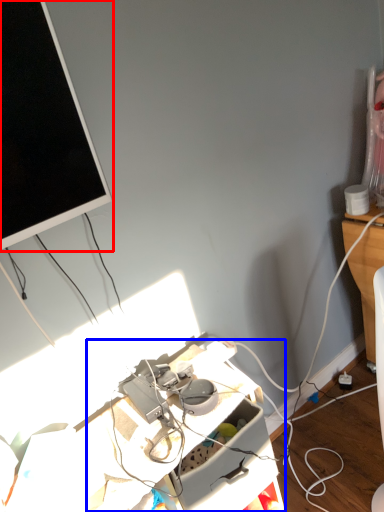
Question: Which of the following is the farthest to the observer, television (highlighted by a red box) or computer desk (highlighted by a blue box)?

Choices:
 (A) television
 (B) computer desk

Answer: (B)